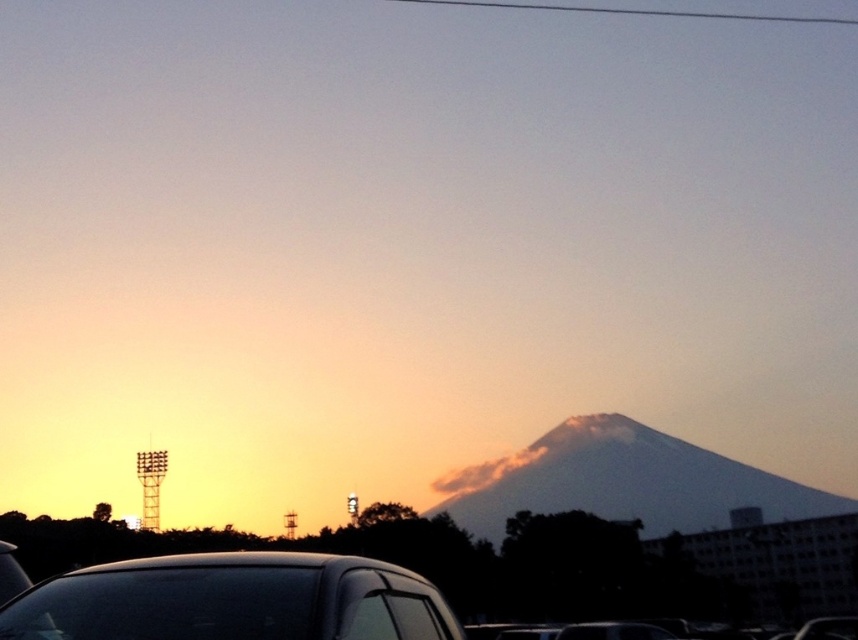
Identify the location of shiny black car at lower left. (233, 600).

Does shiny black car at lower left have a lesser width compared to smooth wire at upper center?

Yes, shiny black car at lower left is thinner than smooth wire at upper center.

I want to click on shiny black car at lower left, so click(233, 600).

Where is `shiny black car at lower left`? shiny black car at lower left is located at coordinates (233, 600).

Which is more to the right, smokey white cloud at center or smooth wire at upper center?

smooth wire at upper center is more to the right.

Who is higher up, smokey white cloud at center or smooth wire at upper center?

Positioned higher is smooth wire at upper center.

This screenshot has height=640, width=858. What do you see at coordinates (541, 452) in the screenshot?
I see `smokey white cloud at center` at bounding box center [541, 452].

Find the location of a particular element. This screenshot has width=858, height=640. smokey white cloud at center is located at coordinates (541, 452).

Can you confirm if smokey gray mountain at center is shorter than smooth wire at upper center?

Incorrect, smokey gray mountain at center's height does not fall short of smooth wire at upper center's.

Does smokey gray mountain at center appear on the right side of smooth wire at upper center?

In fact, smokey gray mountain at center is to the left of smooth wire at upper center.

Is point (765, 486) closer to camera compared to point (748, 13)?

Yes, it is in front of point (748, 13).

I want to click on smokey gray mountain at center, so click(624, 483).